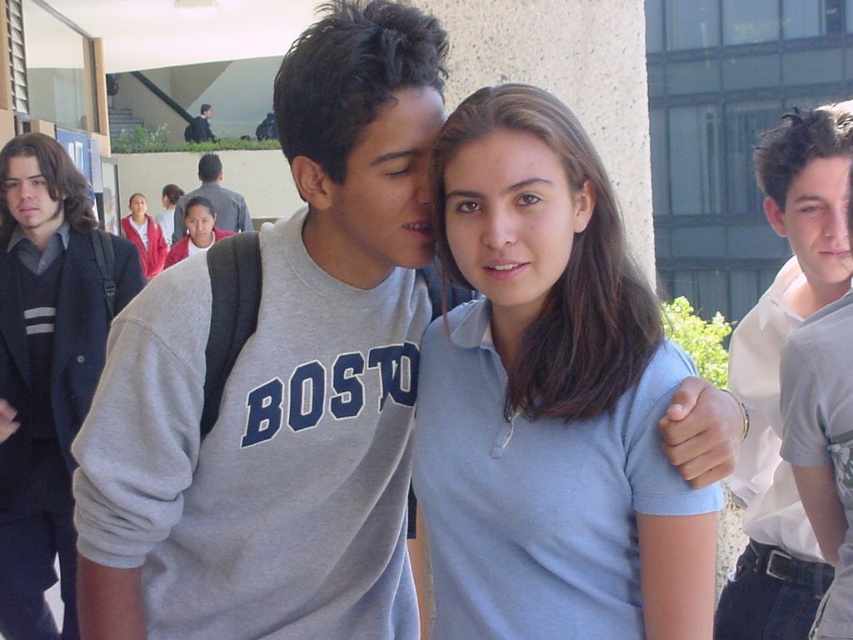
Question: In this image, where is matte gray sweatshirt at center located relative to matte pink shirt at center?

Choices:
 (A) left
 (B) right

Answer: (A)

Question: Is gray sweatshirt at center to the left of dark gray backpack at upper left from the viewer's perspective?

Choices:
 (A) no
 (B) yes

Answer: (A)

Question: Which object appears farthest from the camera in this image?

Choices:
 (A) matte pink shirt at center
 (B) white cotton shirt at upper right
 (C) gray sweatshirt at center
 (D) dark gray sweater at left

Answer: (A)

Question: Which object appears farthest from the camera in this image?

Choices:
 (A) dark gray sweater at left
 (B) light blue cotton shirt at center
 (C) dark gray backpack at upper left
 (D) matte pink shirt at center

Answer: (C)

Question: Considering the relative positions of matte red hoodie at upper left and dark gray backpack at upper left in the image provided, where is matte red hoodie at upper left located with respect to dark gray backpack at upper left?

Choices:
 (A) below
 (B) above

Answer: (A)

Question: Which of these objects is positioned farthest from the matte red hoodie at upper left?

Choices:
 (A) white cotton shirt at upper right
 (B) matte pink shirt at center
 (C) dark gray sweater at left
 (D) matte gray sweatshirt at center

Answer: (A)